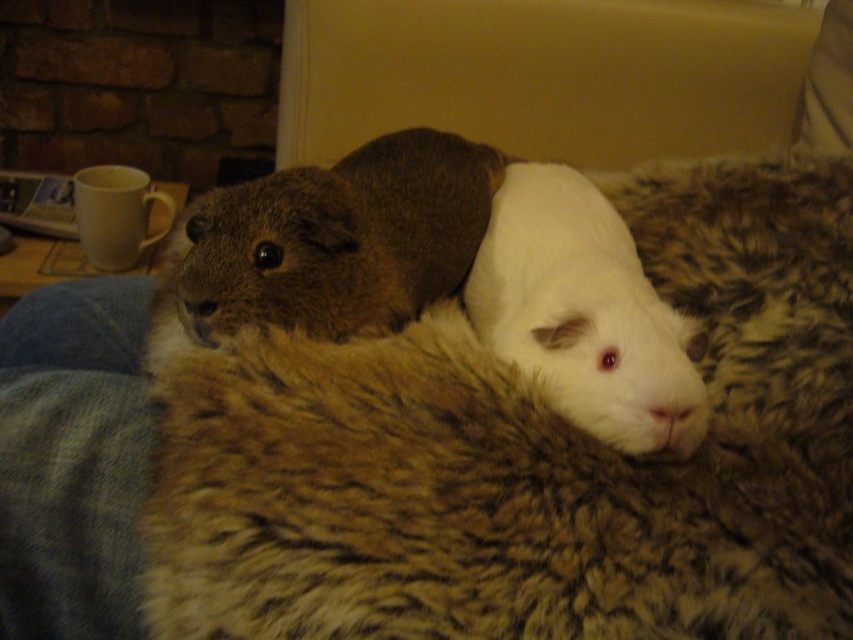
You are taking a photo of two guinea pigs on a blanket. You notice two points in the image labeled as point (264,205) and point (660,385). Which point is closer to the camera?

Point (264,205) is closer to the camera than point (660,385) because it is further to the camera than the latter.

Consider the image. You are a pet owner who wants to place both hamsters in a rectangular enclosure. The enclosure has a width of 10 cm. Knowing that the brown fuzzy hamster at upper center is wider than the white soft fur hamster at center, can both fit side by side without overlapping?

The brown fuzzy hamster at upper center is wider than the white soft fur hamster at center. However, since the enclosure is 10 cm wide, and the combined width of both hamsters may exceed this, it depends on their exact widths. Without specific measurements, it is uncertain if they can fit side by side without overlapping.

You are a small animal and want to move from the brown fuzzy hamster at upper center to the white soft fur hamster at center. Which direction should you go to get closer to the white soft fur fur hamster at center?

To get closer to the white soft fur hamster at center, you should move backward since the brown fuzzy hamster at upper center is closer to you than the white soft fur hamster at center.